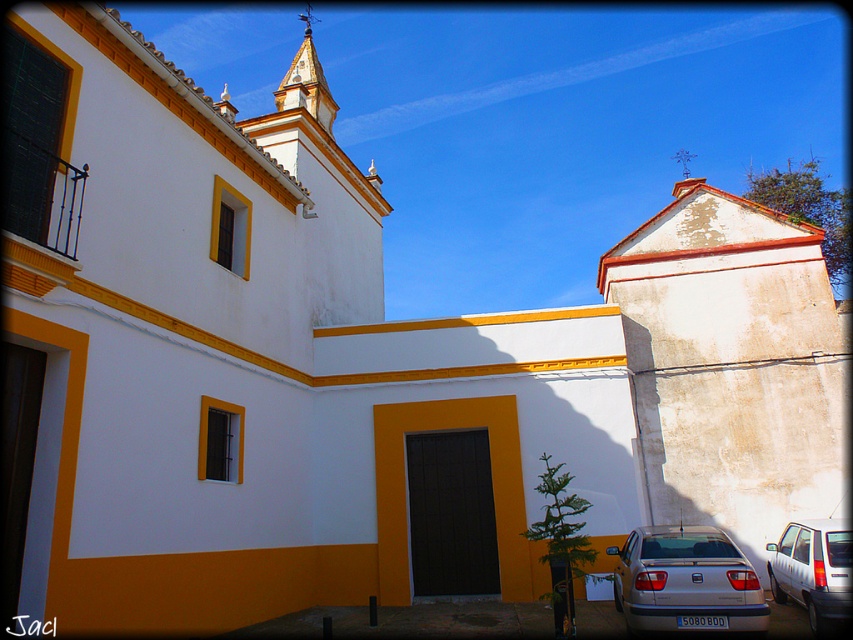
Question: Estimate the real-world distances between objects in this image. Which object is closer to the gold textured spire at upper center?

Choices:
 (A) white matte car at lower right
 (B) silver metallic car at lower right

Answer: (B)

Question: Which object is the closest to the white matte car at lower right?

Choices:
 (A) gold textured spire at upper center
 (B) silver metallic car at lower right

Answer: (B)

Question: Does white matte car at lower right appear on the left side of gold textured spire at upper center?

Choices:
 (A) yes
 (B) no

Answer: (B)

Question: Can you confirm if silver metallic car at lower right is smaller than white matte car at lower right?

Choices:
 (A) yes
 (B) no

Answer: (B)

Question: Can you confirm if silver metallic car at lower right is bigger than white matte car at lower right?

Choices:
 (A) yes
 (B) no

Answer: (A)

Question: Which object is positioned farthest from the silver metallic car at lower right?

Choices:
 (A) gold textured spire at upper center
 (B) white matte car at lower right

Answer: (A)